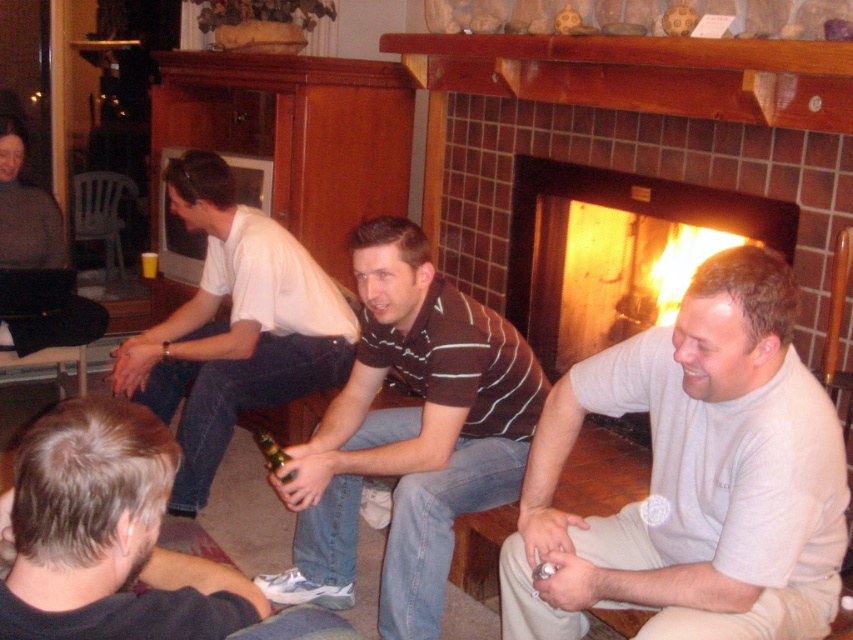
Question: Which object is positioned closest to the green glass bottle at center?

Choices:
 (A) brick fireplace at center
 (B) white cotton shirt at center

Answer: (B)

Question: Is white cotton shirt at center bigger than green glass bottle at center?

Choices:
 (A) no
 (B) yes

Answer: (B)

Question: Does denim jeans at lower left have a lesser width compared to brick fireplace at center?

Choices:
 (A) no
 (B) yes

Answer: (B)

Question: Is white turtleneck sweater at lower right smaller than denim jeans at lower left?

Choices:
 (A) no
 (B) yes

Answer: (A)

Question: Which object appears farthest from the camera in this image?

Choices:
 (A) brick fireplace at center
 (B) green glass bottle at center
 (C) white turtleneck sweater at lower right

Answer: (A)

Question: Which object is positioned farthest from the brick fireplace at center?

Choices:
 (A) striped polo shirt at center
 (B) green glass bottle at center

Answer: (B)